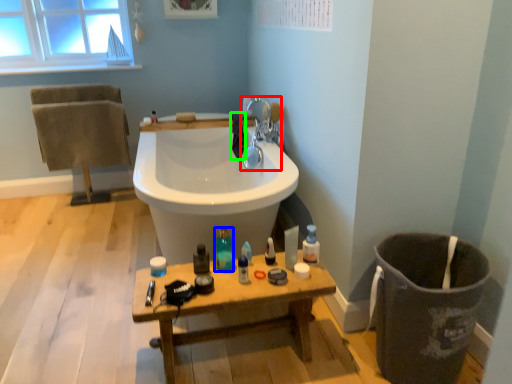
Question: Which object is positioned closest to tap (highlighted by a red box)? Select from toiletry (highlighted by a blue box) and bath towel (highlighted by a green box).

Choices:
 (A) toiletry
 (B) bath towel

Answer: (B)